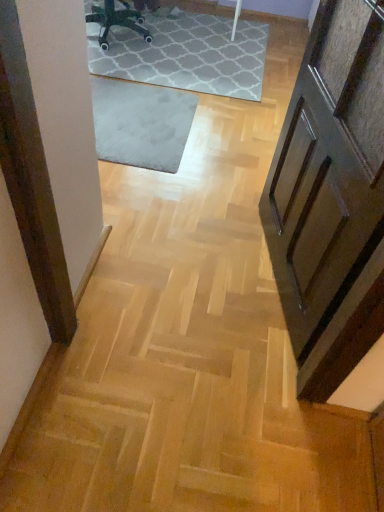
What do you see at coordinates (331, 197) in the screenshot? Image resolution: width=384 pixels, height=512 pixels. I see `wooden panelled door at right` at bounding box center [331, 197].

The height and width of the screenshot is (512, 384). Describe the element at coordinates (141, 123) in the screenshot. I see `gray soft rug at center` at that location.

What do you see at coordinates (117, 20) in the screenshot?
I see `black plastic chair at upper center` at bounding box center [117, 20].

At what (x,y) coordinates should I click in order to perform the action: click on black plastic chair at upper center. Please return your answer as a coordinate pair (x, y). This screenshot has width=384, height=512. Looking at the image, I should click on (117, 20).

Locate an element on the screen. wooden panelled door at right is located at coordinates (331, 197).

Considering the sizes of objects gray soft rug at center and wooden panelled door at right in the image provided, who is taller, gray soft rug at center or wooden panelled door at right?

With more height is wooden panelled door at right.

From the image's perspective, which one is positioned higher, gray soft rug at center or wooden panelled door at right?

From the image's view, gray soft rug at center is above.

Is gray soft rug at center looking in the opposite direction of wooden panelled door at right?

gray soft rug at center does not have its back to wooden panelled door at right.

Is gray soft rug at center aimed at black plastic chair at upper center?

No.

Is gray soft rug at center touching black plastic chair at upper center?

No, gray soft rug at center is not touching black plastic chair at upper center.

Which point is more forward, (161, 158) or (125, 7)?

The point (161, 158) is closer to the camera.

Is gray soft rug at center behind black plastic chair at upper center?

No, gray soft rug at center is closer to the camera.

Would you consider black plastic chair at upper center to be distant from wooden panelled door at right?

Absolutely, black plastic chair at upper center is distant from wooden panelled door at right.

From a real-world perspective, is black plastic chair at upper center below wooden panelled door at right?

Indeed, from a real-world perspective, black plastic chair at upper center is positioned beneath wooden panelled door at right.

Can you see wooden panelled door at right touching black plastic chair at upper center?

No, wooden panelled door at right is not with black plastic chair at upper center.

Is wooden panelled door at right oriented away from black plastic chair at upper center?

That's not correct — wooden panelled door at right is not looking away from black plastic chair at upper center.

Find the location of `door to the right of black plastic chair at upper center`. door to the right of black plastic chair at upper center is located at coordinates (331, 197).

Which is behind, wooden panelled door at right or black plastic chair at upper center?

black plastic chair at upper center is behind.

Considering the sizes of objects black plastic chair at upper center and gray soft rug at center in the image provided, who is wider, black plastic chair at upper center or gray soft rug at center?

gray soft rug at center is wider.

How different are the orientations of black plastic chair at upper center and gray soft rug at center in degrees?

black plastic chair at upper center and gray soft rug at center are facing 14.6 degrees away from each other.

Is black plastic chair at upper center in front of or behind gray soft rug at center in the image?

Clearly, black plastic chair at upper center is behind gray soft rug at center.

Is black plastic chair at upper center located outside gray soft rug at center?

Yes, black plastic chair at upper center is outside of gray soft rug at center.

Would you say gray soft rug at center is part of wooden panelled door at right's contents?

No, wooden panelled door at right does not contain gray soft rug at center.

Is wooden panelled door at right facing towards gray soft rug at center?

No, wooden panelled door at right is not oriented towards gray soft rug at center.

From the image's perspective, which one is positioned lower, wooden panelled door at right or gray soft rug at center?

wooden panelled door at right appears lower in the image.

Is wooden panelled door at right with gray soft rug at center?

No.

Locate an element on the screen. The height and width of the screenshot is (512, 384). door located below the gray soft rug at center (from the image's perspective) is located at coordinates (331, 197).

Where is `mat on the right of black plastic chair at upper center`? mat on the right of black plastic chair at upper center is located at coordinates (141, 123).

Which object lies further to the anchor point wooden panelled door at right, gray soft rug at center or black plastic chair at upper center?

black plastic chair at upper center is further to wooden panelled door at right.

Looking at the image, which one is located closer to wooden panelled door at right, black plastic chair at upper center or gray soft rug at center?

gray soft rug at center.

Looking at the image, which one is located further to black plastic chair at upper center, gray soft rug at center or wooden panelled door at right?

wooden panelled door at right is further to black plastic chair at upper center.

Looking at the image, which one is located closer to gray soft rug at center, wooden panelled door at right or black plastic chair at upper center?

Based on the image, black plastic chair at upper center appears to be nearer to gray soft rug at center.

When comparing their distances from gray soft rug at center, does black plastic chair at upper center or wooden panelled door at right seem further?

wooden panelled door at right is positioned further to the anchor gray soft rug at center.

Considering their positions, is wooden panelled door at right positioned further to black plastic chair at upper center than gray soft rug at center?

The object further to black plastic chair at upper center is wooden panelled door at right.

Identify the location of mat located between wooden panelled door at right and black plastic chair at upper center in the depth direction. This screenshot has height=512, width=384. (141, 123).